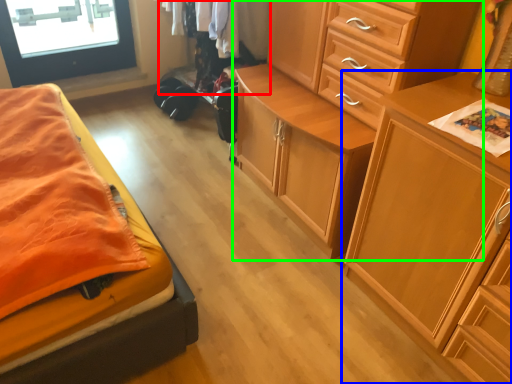
Question: Estimate the real-world distances between objects in this image. Which object is closer to clothing (highlighted by a red box), chest of drawers (highlighted by a blue box) or chest of drawers (highlighted by a green box)?

Choices:
 (A) chest of drawers
 (B) chest of drawers

Answer: (B)